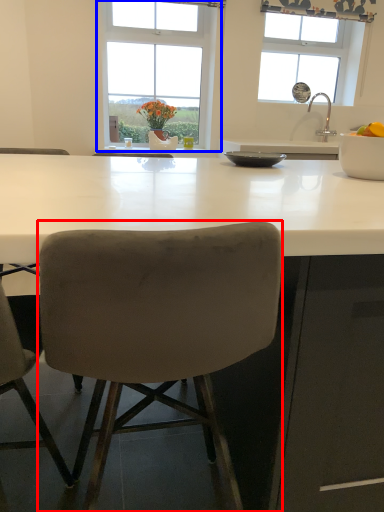
Question: Which object appears closest to the camera in this image, chair (highlighted by a red box) or window (highlighted by a blue box)?

Choices:
 (A) chair
 (B) window

Answer: (A)